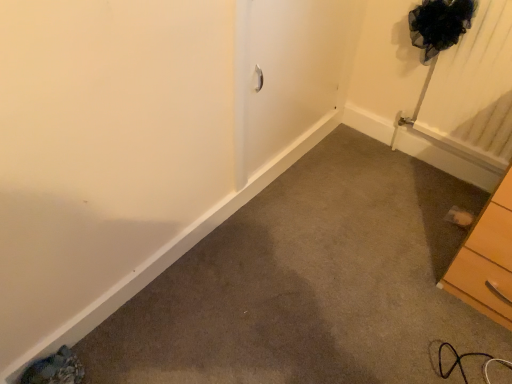
Question: Can you confirm if wooden chest of drawers at lower right is shorter than silver metallic screen door at center?

Choices:
 (A) yes
 (B) no

Answer: (A)

Question: Is wooden chest of drawers at lower right wider than silver metallic screen door at center?

Choices:
 (A) no
 (B) yes

Answer: (B)

Question: From a real-world perspective, is wooden chest of drawers at lower right physically above silver metallic screen door at center?

Choices:
 (A) yes
 (B) no

Answer: (B)

Question: Does wooden chest of drawers at lower right come in front of silver metallic screen door at center?

Choices:
 (A) no
 (B) yes

Answer: (B)

Question: Is wooden chest of drawers at lower right positioned far away from silver metallic screen door at center?

Choices:
 (A) yes
 (B) no

Answer: (B)

Question: From the image's perspective, is wooden chest of drawers at lower right above silver metallic screen door at center?

Choices:
 (A) yes
 (B) no

Answer: (B)

Question: Can you confirm if silver metallic screen door at center is positioned to the left of wooden chest of drawers at lower right?

Choices:
 (A) no
 (B) yes

Answer: (B)

Question: Is silver metallic screen door at center oriented towards wooden chest of drawers at lower right?

Choices:
 (A) yes
 (B) no

Answer: (A)

Question: Does silver metallic screen door at center come behind wooden chest of drawers at lower right?

Choices:
 (A) yes
 (B) no

Answer: (A)

Question: From the image's perspective, would you say silver metallic screen door at center is shown under wooden chest of drawers at lower right?

Choices:
 (A) no
 (B) yes

Answer: (A)

Question: Is silver metallic screen door at center beside wooden chest of drawers at lower right?

Choices:
 (A) no
 (B) yes

Answer: (A)

Question: Is silver metallic screen door at center smaller than wooden chest of drawers at lower right?

Choices:
 (A) yes
 (B) no

Answer: (A)

Question: Considering the positions of point click(x=460, y=286) and point click(x=312, y=122), is point click(x=460, y=286) closer or farther from the camera than point click(x=312, y=122)?

Choices:
 (A) closer
 (B) farther

Answer: (A)